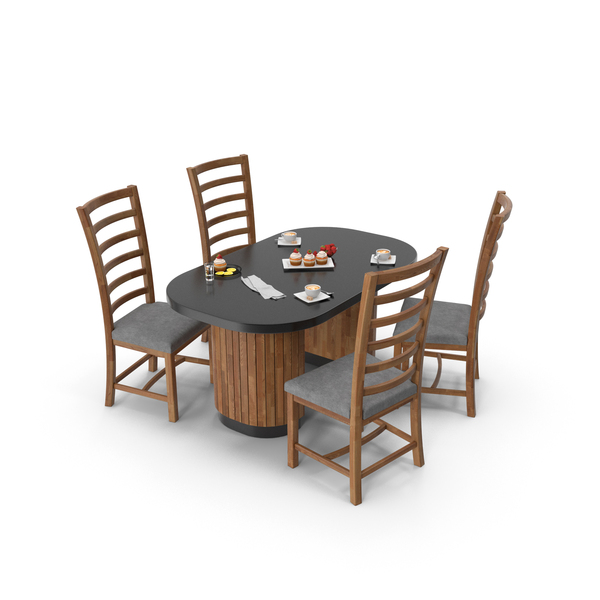
The height and width of the screenshot is (600, 600). Find the location of `black saucer`. black saucer is located at coordinates (236, 274).